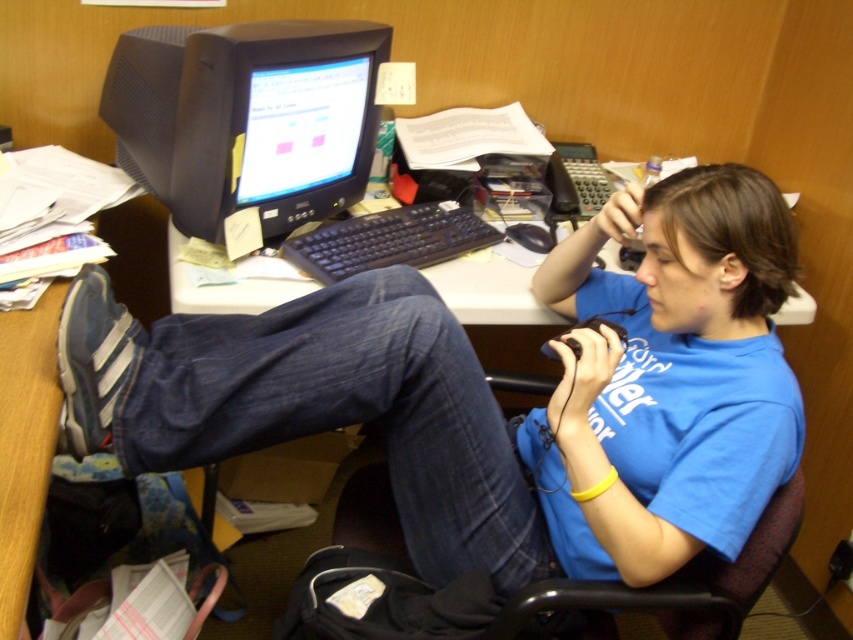
Question: Estimate the real-world distances between objects in this image. Which object is closer to the blue cotton shirt at center?

Choices:
 (A) matte black monitor at center
 (B) black plastic keyboard at center

Answer: (B)

Question: In this image, where is blue cotton shirt at center located relative to matte black monitor at center?

Choices:
 (A) left
 (B) right

Answer: (B)

Question: Can you confirm if white plastic table at center is positioned above black plastic keyboard at center?

Choices:
 (A) no
 (B) yes

Answer: (A)

Question: Based on their relative distances, which object is nearer to the matte black monitor at center?

Choices:
 (A) white plastic table at center
 (B) blue cotton shirt at center

Answer: (A)

Question: Which object appears closest to the camera in this image?

Choices:
 (A) black plastic keyboard at center
 (B) matte black monitor at center
 (C) white plastic table at center
 (D) blue cotton shirt at center

Answer: (D)

Question: Where is matte black monitor at center located in relation to white plastic table at center in the image?

Choices:
 (A) above
 (B) below

Answer: (A)